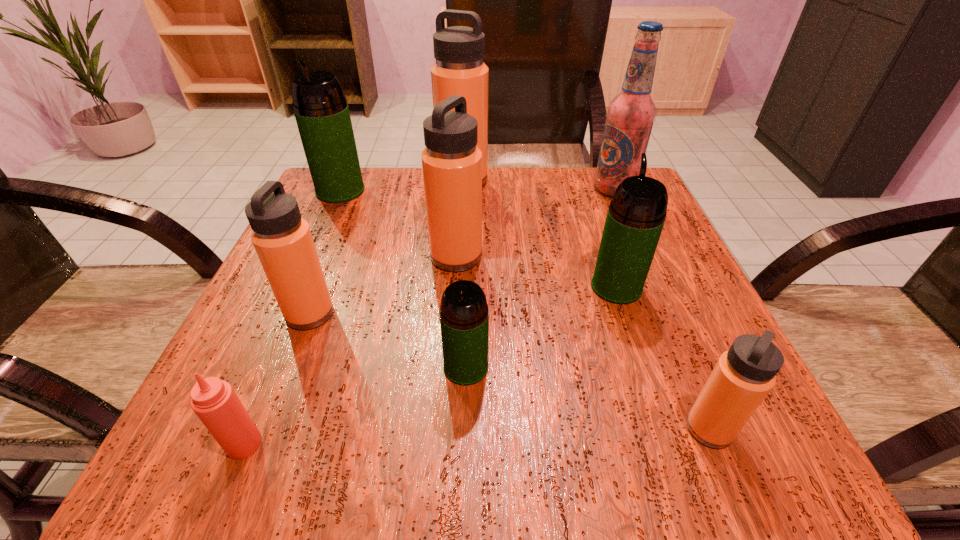
Locate an element on the screen. Image resolution: width=960 pixels, height=540 pixels. free space located from the spout of the rightmost green thermos bottle is located at coordinates (588, 203).

You are a GUI agent. You are given a task and a screenshot of the screen. Output one action in this format:
    pyautogui.click(x=<x>, y=<y>)
    Task: Click on the vacant space located from the spout of the rightmost green thermos bottle
    The height and width of the screenshot is (540, 960).
    Given the screenshot: What is the action you would take?
    pyautogui.click(x=586, y=196)

This screenshot has width=960, height=540. I want to click on vacant space located on the back of the second nearest orange thermos bottle, so click(334, 251).

Locate an element on the screen. The height and width of the screenshot is (540, 960). vacant region located from the spout of the second nearest thermos bottle is located at coordinates (463, 469).

The image size is (960, 540). I want to click on vacant space situated 0.330m on the back of the nearest orange thermos bottle, so click(x=637, y=256).

The width and height of the screenshot is (960, 540). Identify the location of vacant space located on the back of the Tabasco sauce. (287, 340).

Image resolution: width=960 pixels, height=540 pixels. I want to click on alcohol that is at the far edge, so click(630, 115).

Image resolution: width=960 pixels, height=540 pixels. In order to click on thermos bottle present at the near edge in this screenshot , I will do `click(743, 376)`.

At what (x,y) coordinates should I click in order to perform the action: click on Tabasco sauce positioned at the near edge. Please return your answer as a coordinate pair (x, y). The image size is (960, 540). Looking at the image, I should click on (214, 401).

The height and width of the screenshot is (540, 960). What are the coordinates of `Tabasco sauce present at the left edge` in the screenshot? It's located at (214, 401).